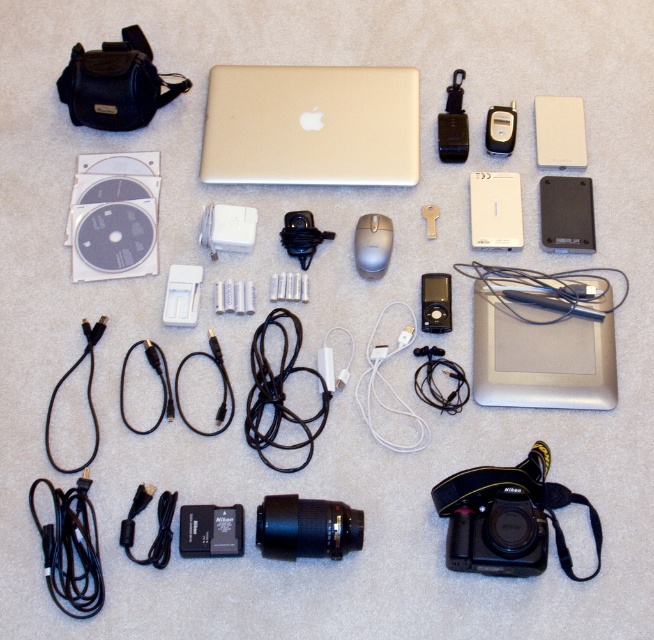
Which is in front, point (485, 198) or point (489, 129)?

Point (485, 198)

Between satin silver ipod at center and black plastic digital camera at upper right, which one appears on the right side from the viewer's perspective?

Positioned to the right is black plastic digital camera at upper right.

This screenshot has width=654, height=640. What do you see at coordinates (494, 209) in the screenshot? I see `satin silver ipod at center` at bounding box center [494, 209].

The image size is (654, 640). Identify the location of satin silver ipod at center. (494, 209).

How much distance is there between black plastic hard drive at upper right and silver metallic mouse at center?

black plastic hard drive at upper right is 13.17 inches away from silver metallic mouse at center.

Is black plastic hard drive at upper right above silver metallic mouse at center?

Yes, black plastic hard drive at upper right is above silver metallic mouse at center.

Does point (540, 240) come farther from viewer compared to point (381, 262)?

Yes, point (540, 240) is farther from viewer.

At what (x,y) coordinates should I click in order to perform the action: click on black plastic hard drive at upper right. Please return your answer as a coordinate pair (x, y). Image resolution: width=654 pixels, height=640 pixels. Looking at the image, I should click on (566, 214).

Between black plastic charger at center and satin black ipod at center, which one has less height?

black plastic charger at center is shorter.

Looking at this image, does black plastic charger at center have a lesser width compared to satin black ipod at center?

Incorrect, black plastic charger at center's width is not less than satin black ipod at center's.

Is point (283, 221) more distant than point (439, 280)?

That is True.

This screenshot has width=654, height=640. I want to click on black plastic charger at center, so click(301, 236).